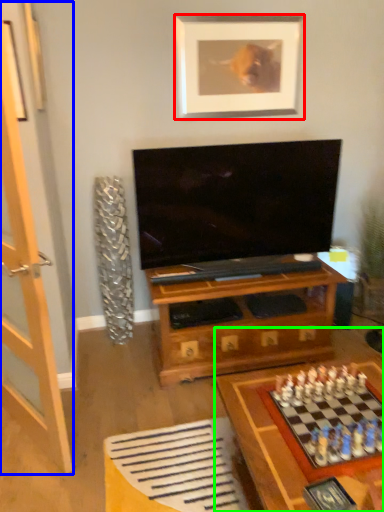
Question: Estimate the real-world distances between objects in this image. Which object is farther from picture frame (highlighted by a red box), glass door (highlighted by a blue box) or table (highlighted by a green box)?

Choices:
 (A) glass door
 (B) table

Answer: (B)